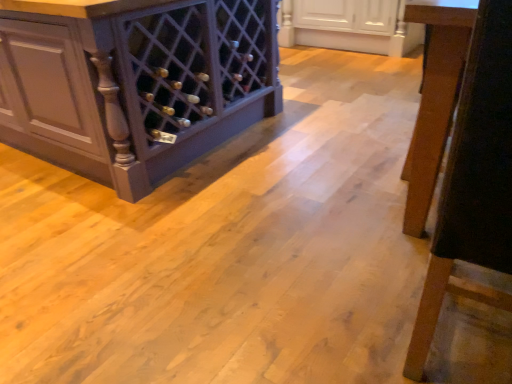
At what (x,y) coordinates should I click in order to perform the action: click on vacant location behind wooden chair leg at right. Please return your answer as a coordinate pair (x, y). This screenshot has height=384, width=512. Looking at the image, I should click on (359, 253).